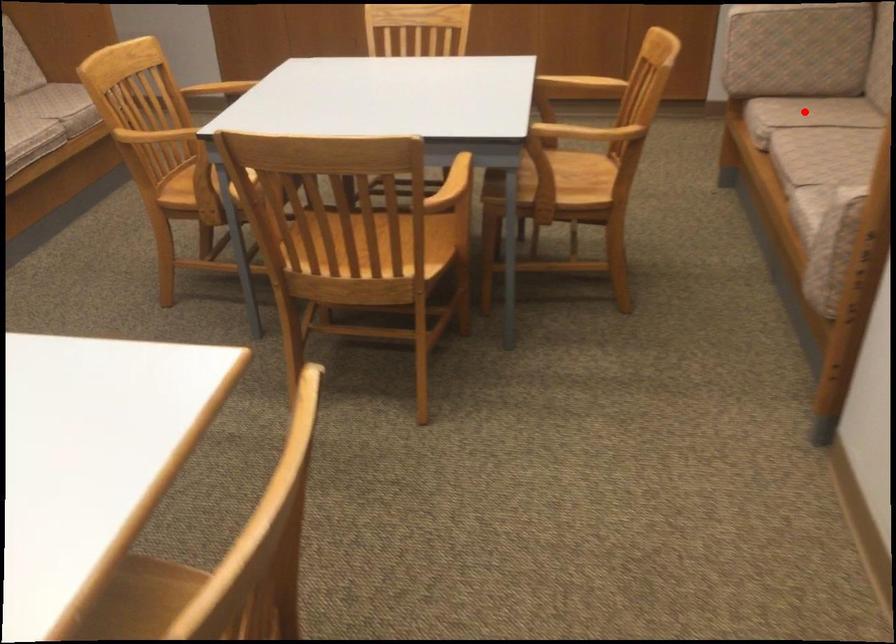
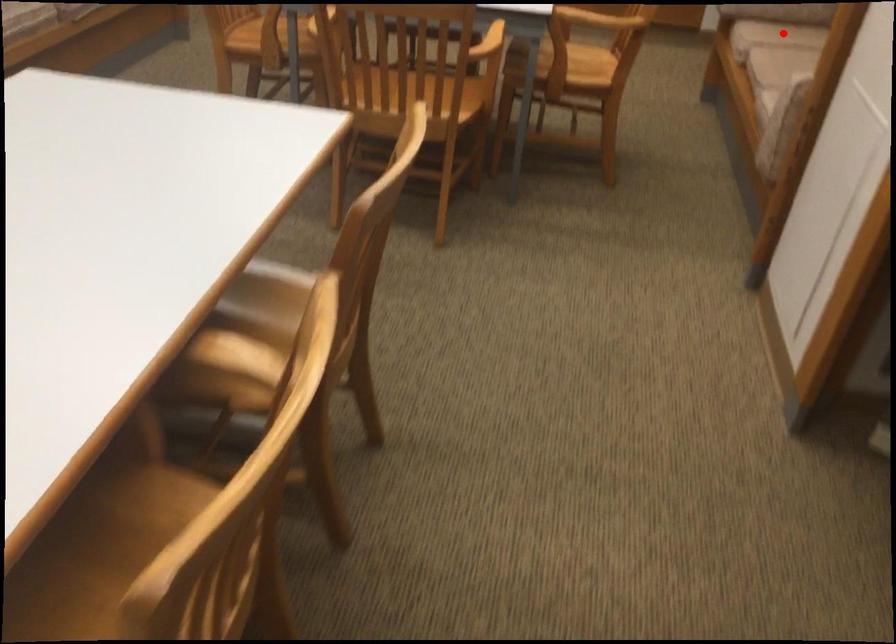
I am providing you with two images of the same scene from different viewpoints. A red point is marked on the first image and another point is marked on the second image. Are the points marked in image1 and image2 representing the same 3D position?

Yes